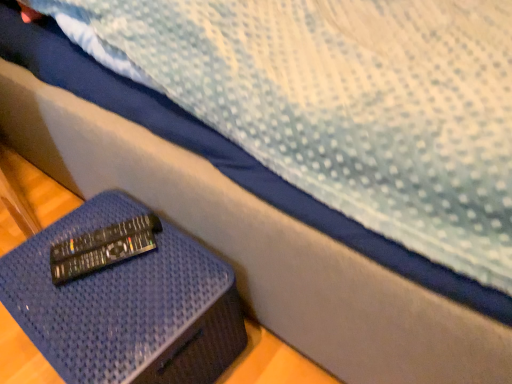
Question: Is the depth of black plastic remote at lower left, the second remote viewed from the back, less than that of blue textured ottoman at lower left?

Choices:
 (A) no
 (B) yes

Answer: (A)

Question: Is black plastic remote at lower left, which is the first remote from front to back, directly adjacent to blue textured ottoman at lower left?

Choices:
 (A) no
 (B) yes

Answer: (A)

Question: From the image's perspective, is black plastic remote at lower left, the second remote viewed from the back, beneath blue textured ottoman at lower left?

Choices:
 (A) no
 (B) yes

Answer: (A)

Question: Can you confirm if black plastic remote at lower left, which is the first remote from front to back, is smaller than blue textured ottoman at lower left?

Choices:
 (A) yes
 (B) no

Answer: (A)

Question: From the image's perspective, is black plastic remote at lower left, which is the first remote from front to back, above blue textured ottoman at lower left?

Choices:
 (A) yes
 (B) no

Answer: (A)

Question: Is point [x=65, y=256] closer or farther from the camera than point [x=74, y=248]?

Choices:
 (A) closer
 (B) farther

Answer: (A)

Question: In terms of height, does black plastic remote at lower left, acting as the 2th remote starting from the front, look taller or shorter compared to black plastic remote at lower left, the second remote viewed from the back?

Choices:
 (A) short
 (B) tall

Answer: (A)

Question: Considering their positions, is black plastic remote at lower left, acting as the 2th remote starting from the front, located in front of or behind black plastic remote at lower left, the second remote viewed from the back?

Choices:
 (A) front
 (B) behind

Answer: (B)

Question: Considering the positions of black plastic remote at lower left, acting as the 1th remote starting from the back, and black plastic remote at lower left, which is the first remote from front to back, in the image, is black plastic remote at lower left, acting as the 1th remote starting from the back, wider or thinner than black plastic remote at lower left, which is the first remote from front to back,?

Choices:
 (A) thin
 (B) wide

Answer: (B)

Question: Choose the correct answer: Is black plastic remote at lower left, the second remote viewed from the back, inside blue textured ottoman at lower left or outside it?

Choices:
 (A) inside
 (B) outside

Answer: (B)

Question: Is black plastic remote at lower left, the second remote viewed from the back, to the left or to the right of blue textured ottoman at lower left in the image?

Choices:
 (A) left
 (B) right

Answer: (A)

Question: Does point (90, 271) appear closer or farther from the camera than point (138, 289)?

Choices:
 (A) closer
 (B) farther

Answer: (B)

Question: Is black plastic remote at lower left, which is the first remote from front to back, wider or thinner than blue textured ottoman at lower left?

Choices:
 (A) thin
 (B) wide

Answer: (A)

Question: Is point (146, 233) closer or farther from the camera than point (72, 251)?

Choices:
 (A) farther
 (B) closer

Answer: (A)

Question: Would you say black plastic remote at lower left, the second remote viewed from the back, is inside or outside black plastic remote at lower left, acting as the 1th remote starting from the back?

Choices:
 (A) outside
 (B) inside

Answer: (A)